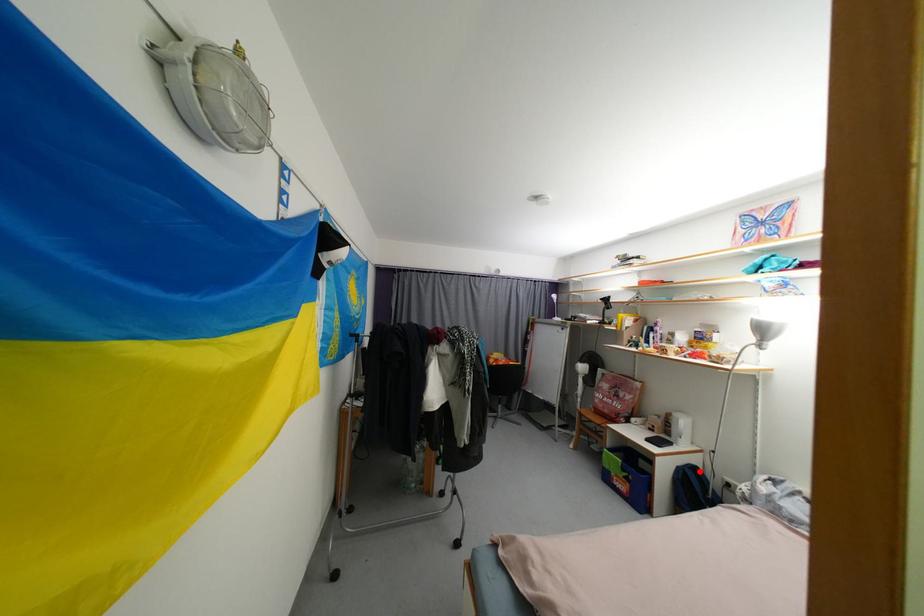
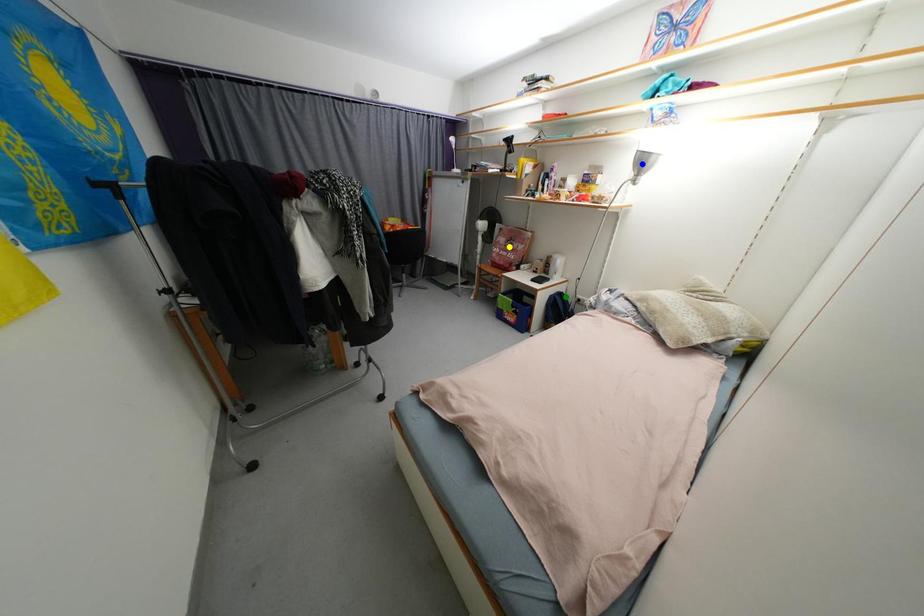
Question: I am providing you with two images of the same scene from different viewpoints. A red point is marked on the first image. You are given multiple points on the second image. Which mark in image 2 goes with the point in image 1?

Choices:
 (A) green point
 (B) yellow point
 (C) blue point

Answer: (A)